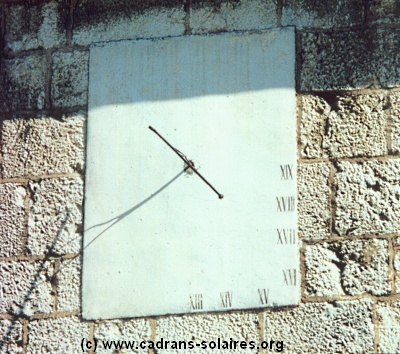
You are a GUI agent. You are given a task and a screenshot of the screen. Output one action in this format:
    pyautogui.click(x=<x>, y=<y>)
    Task: Click on the blank space on left of clock
    The image size is (400, 354).
    Given the screenshot: What is the action you would take?
    pyautogui.click(x=134, y=168)